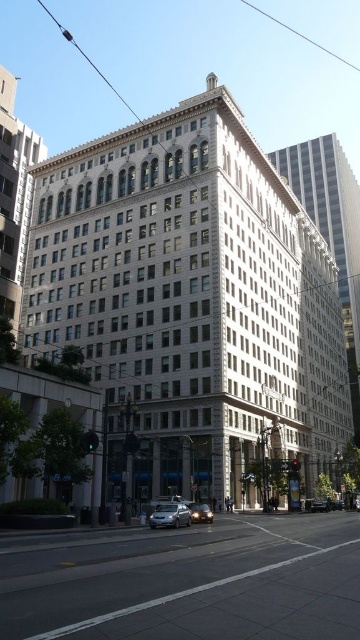
Question: Does satin silver sedan at lower center appear on the right side of shiny silver sedan at center?

Choices:
 (A) yes
 (B) no

Answer: (B)

Question: Which of the following is the closest to the observer?

Choices:
 (A) (155, 525)
 (B) (199, 513)

Answer: (A)

Question: Which point appears closest to the camera in this image?

Choices:
 (A) (312, 508)
 (B) (190, 508)
 (C) (176, 516)

Answer: (C)

Question: Does satin silver sedan at lower center appear under shiny silver sedan at center?

Choices:
 (A) yes
 (B) no

Answer: (B)

Question: Which point appears closest to the camera in this image?

Choices:
 (A) (326, 500)
 (B) (168, 515)

Answer: (B)

Question: Is satin silver sedan at lower center thinner than shiny silver sedan at lower center?

Choices:
 (A) no
 (B) yes

Answer: (A)